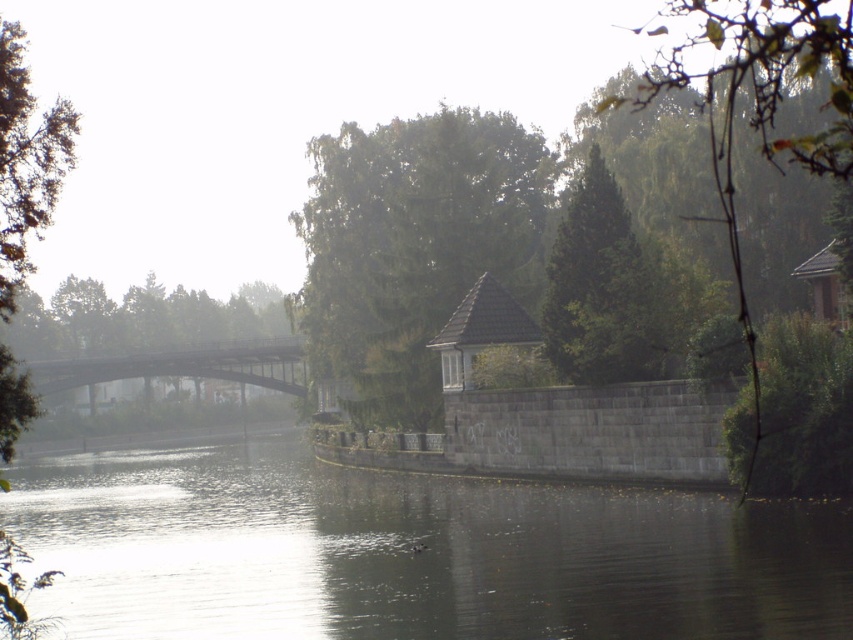
You are standing at the point marked by the coordinates (413, 246) in the image. What do you see directly in front of you?

At the coordinates (413, 246), there is a green leafy tree at center, so you would see the green leafy tree at center directly in front of you.

In the scene shown: You are standing at point (154, 333) in the riverside scene. What object is located exactly at your current position?

The green matte tree at left is located exactly at point (154, 333).

You are standing at the point with coordinates (410, 554) in the riverside scene. What is the main feature you would see around you?

The point at (410, 554) indicates dark reflective water at center, so you would be surrounded by dark reflective water at center.